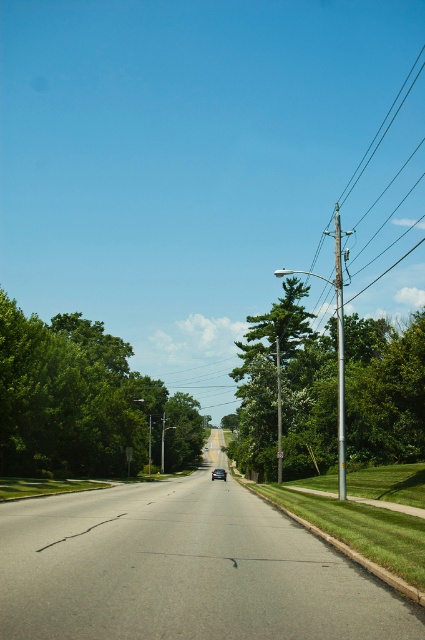
You are a bird looking for a nesting spot. You see the green leafy tree at right and the green leafy tree at left. Which tree would be a better choice for a higher nest location?

The green leafy tree at right is taller than the green leafy tree at left, so it would provide a higher nesting spot for the bird.

You are a delivery drone flying above the suburban street scene. You need to land at the exact point specified by the coordinates point (x=286, y=390). What object will you land on?

The point (x=286, y=390) corresponds to the green leafy tree at right, so you will land on the green leafy tree at right.